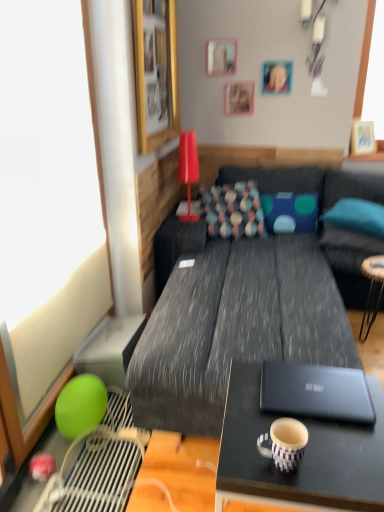
Question: Is wooden picture frame at upper right, which is the fifth picture frame in left-to-right order, positioned behind blue dotted pillow at right, which is the 3th pillow from left to right?

Choices:
 (A) yes
 (B) no

Answer: (A)

Question: Is wooden picture frame at upper right, which is the fifth picture frame in left-to-right order, not close to blue dotted pillow at right, marked as the 1th pillow in a right-to-left arrangement?

Choices:
 (A) no
 (B) yes

Answer: (A)

Question: From the image's perspective, is wooden picture frame at upper right, which is the first picture frame from right to left, above blue dotted pillow at right, which is the 3th pillow from left to right?

Choices:
 (A) no
 (B) yes

Answer: (B)

Question: Can you confirm if wooden picture frame at upper right, which is the fifth picture frame in left-to-right order, is positioned to the right of blue dotted pillow at right, which is the 3th pillow from left to right?

Choices:
 (A) no
 (B) yes

Answer: (B)

Question: Is wooden picture frame at upper right, positioned as the fourth picture frame in front-to-back order, taller than blue dotted pillow at right, marked as the 1th pillow in a right-to-left arrangement?

Choices:
 (A) no
 (B) yes

Answer: (B)

Question: Is wooden picture frame at upper left, placed as the first picture frame when sorted from front to back, spatially inside blue dotted pillow at center, which is the 2th pillow in left-to-right order, or outside of it?

Choices:
 (A) outside
 (B) inside

Answer: (A)

Question: From the image's perspective, is wooden picture frame at upper left, arranged as the fifth picture frame when viewed from the right, above or below blue dotted pillow at center, the 2th pillow when ordered from right to left?

Choices:
 (A) above
 (B) below

Answer: (A)

Question: Is wooden picture frame at upper left, placed as the fifth picture frame when sorted from back to front, bigger or smaller than blue dotted pillow at center, which is the 2th pillow in left-to-right order?

Choices:
 (A) big
 (B) small

Answer: (A)

Question: Considering the relative positions of wooden picture frame at upper left, placed as the fifth picture frame when sorted from back to front, and blue dotted pillow at center, the 2th pillow when ordered from right to left, in the image provided, is wooden picture frame at upper left, placed as the fifth picture frame when sorted from back to front, to the left or to the right of blue dotted pillow at center, the 2th pillow when ordered from right to left,?

Choices:
 (A) right
 (B) left

Answer: (B)

Question: Based on their positions, is wooden picture frame at upper center, which appears as the second picture frame when viewed from the right, located to the left or right of textured gray couch at center?

Choices:
 (A) left
 (B) right

Answer: (B)

Question: Looking at the image, does wooden picture frame at upper center, which appears as the second picture frame when viewed from the front, seem bigger or smaller compared to textured gray couch at center?

Choices:
 (A) small
 (B) big

Answer: (A)

Question: From the image's perspective, is wooden picture frame at upper center, arranged as the 4th picture frame when viewed from the left, above or below textured gray couch at center?

Choices:
 (A) below
 (B) above

Answer: (B)

Question: From a real-world perspective, relative to textured gray couch at center, is wooden picture frame at upper center, which appears as the second picture frame when viewed from the right, vertically above or below?

Choices:
 (A) above
 (B) below

Answer: (A)

Question: Choose the correct answer: Is wooden picture frame at upper center, which appears as the second picture frame when viewed from the front, inside black matte laptop at center or outside it?

Choices:
 (A) outside
 (B) inside

Answer: (A)

Question: Considering the positions of wooden picture frame at upper center, which appears as the second picture frame when viewed from the right, and black matte laptop at center in the image, is wooden picture frame at upper center, which appears as the second picture frame when viewed from the right, wider or thinner than black matte laptop at center?

Choices:
 (A) wide
 (B) thin

Answer: (B)